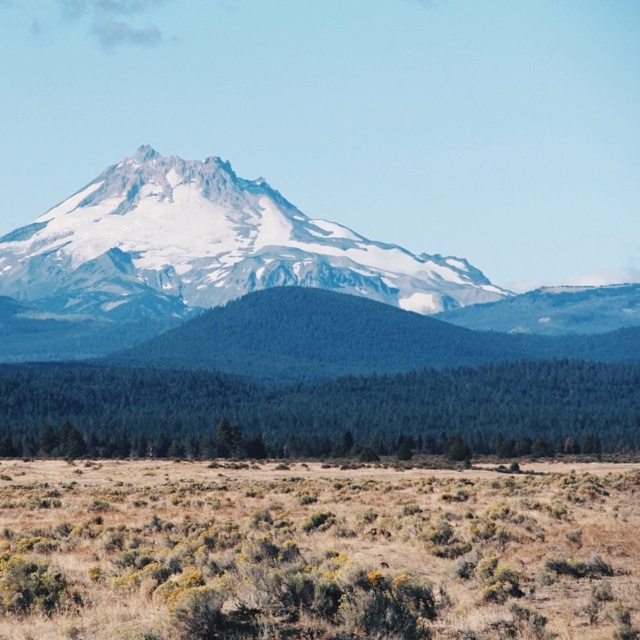
You are standing at the base of the mountain and looking towards the snowcapped peak. You notice two points marked on the mountain slope. One is at point coordinates [552,481] and the other at [136,200]. Which of these points is closer to your current position?

Point [552,481] is closer to the camera than point [136,200], so the point at coordinates [552,481] is closer to your current position.